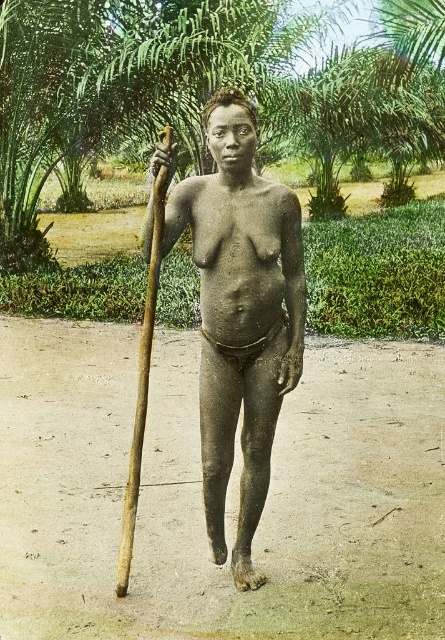
Based on the photo, which is more to the left, brown wooden stick at center or brown wooden spear at left?

brown wooden spear at left is more to the left.

In the scene shown: Between brown wooden stick at center and brown wooden spear at left, which one is positioned lower?

brown wooden spear at left is lower down.

You are a GUI agent. You are given a task and a screenshot of the screen. Output one action in this format:
    pyautogui.click(x=<x>, y=<y>)
    Task: Click on the brown wooden stick at center
    Image resolution: width=445 pixels, height=640 pixels.
    Given the screenshot: What is the action you would take?
    pyautogui.click(x=241, y=316)